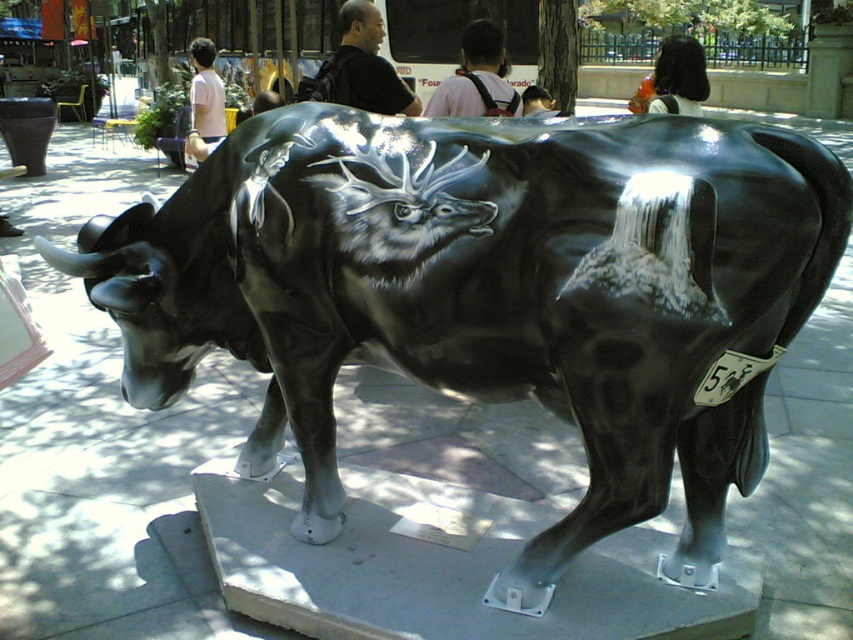
Question: Which object is closer to the camera taking this photo?

Choices:
 (A) black matte shirt at center
 (B) smooth brown hair at upper center

Answer: (A)

Question: Which of these objects is positioned closest to the black hair at upper center?

Choices:
 (A) smooth brown hair at upper center
 (B) black matte shirt at center
 (C) smooth black hair at upper center

Answer: (C)

Question: Can you confirm if black hair at upper center is thinner than smooth brown hair at upper center?

Choices:
 (A) yes
 (B) no

Answer: (B)

Question: Which object is positioned closest to the pink t-shirt at upper left?

Choices:
 (A) smooth black hair at upper center
 (B) black hair at upper center
 (C) smooth brown hair at upper center

Answer: (C)

Question: Is black matte shirt at center closer to the viewer compared to black shirt at upper center?

Choices:
 (A) no
 (B) yes

Answer: (B)

Question: Is black matte shirt at center to the left of smooth black hair at upper center from the viewer's perspective?

Choices:
 (A) yes
 (B) no

Answer: (A)